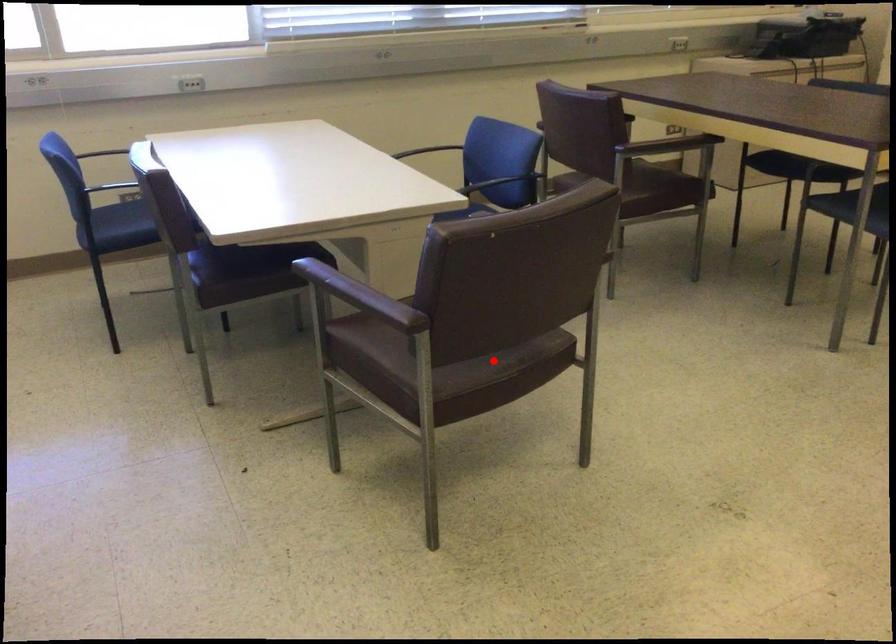
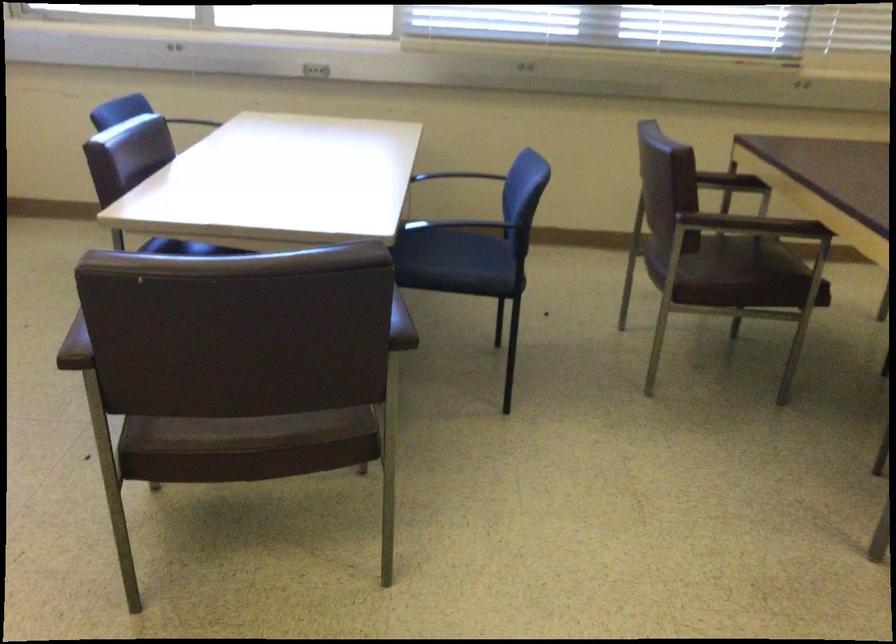
Locate, in the second image, the point that corresponds to the highlighted location in the first image.

(254, 431)